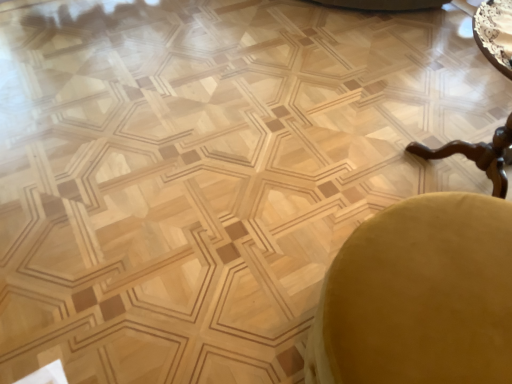
Question: Visually, is velvet yellow swivel chair at lower right positioned to the left or to the right of wooden polished table at right?

Choices:
 (A) right
 (B) left

Answer: (B)

Question: Is velvet yellow swivel chair at lower right in front of or behind wooden polished table at right in the image?

Choices:
 (A) behind
 (B) front

Answer: (B)

Question: From a real-world perspective, is velvet yellow swivel chair at lower right above or below wooden polished table at right?

Choices:
 (A) below
 (B) above

Answer: (A)

Question: From the image's perspective, relative to velvet yellow swivel chair at lower right, is wooden polished table at right above or below?

Choices:
 (A) above
 (B) below

Answer: (A)

Question: Is wooden polished table at right inside the boundaries of velvet yellow swivel chair at lower right, or outside?

Choices:
 (A) inside
 (B) outside

Answer: (B)

Question: Is wooden polished table at right wider or thinner than velvet yellow swivel chair at lower right?

Choices:
 (A) wide
 (B) thin

Answer: (A)

Question: Considering the positions of point (498, 177) and point (476, 314), is point (498, 177) closer or farther from the camera than point (476, 314)?

Choices:
 (A) farther
 (B) closer

Answer: (A)